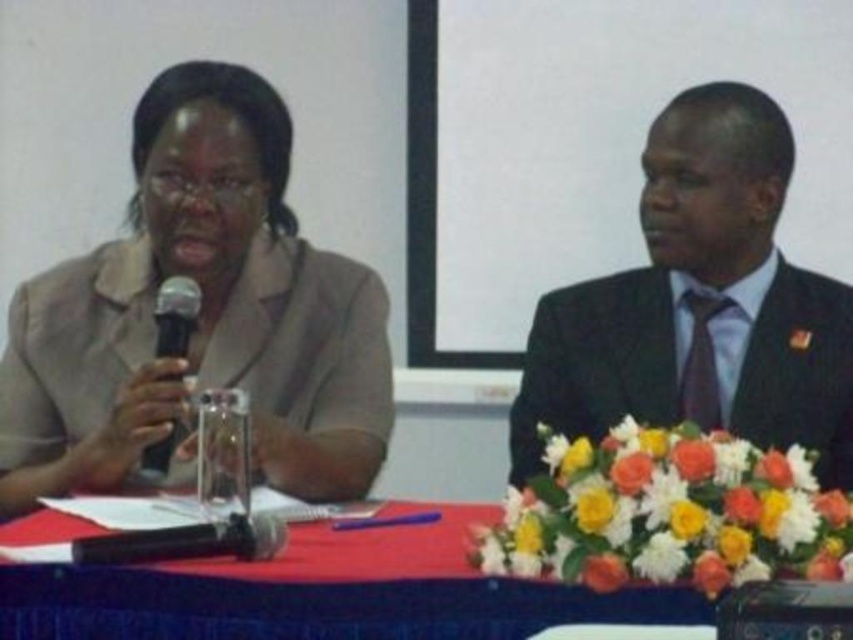
You are organizing a small event and need to seat guests around the red fabric table at center. Given that the black suit at right is a guest who requires a spacious seat, will the table accommodate their seating needs?

The black suit at right has a larger size compared to red fabric table at center, so the table may not provide enough space for the guest requiring a spacious seat.

You are organizing a photoshoot and need to ensure that the matte beige blazer at left and the red fabric table at center are visible in the frame. Based on their sizes, which object should you prioritize positioning closer to the camera to avoid being overshadowed?

The matte beige blazer at left is thinner than the red fabric table at center, so you should prioritize positioning the matte beige blazer at left closer to the camera to ensure it is visible and not overshadowed by the larger table.